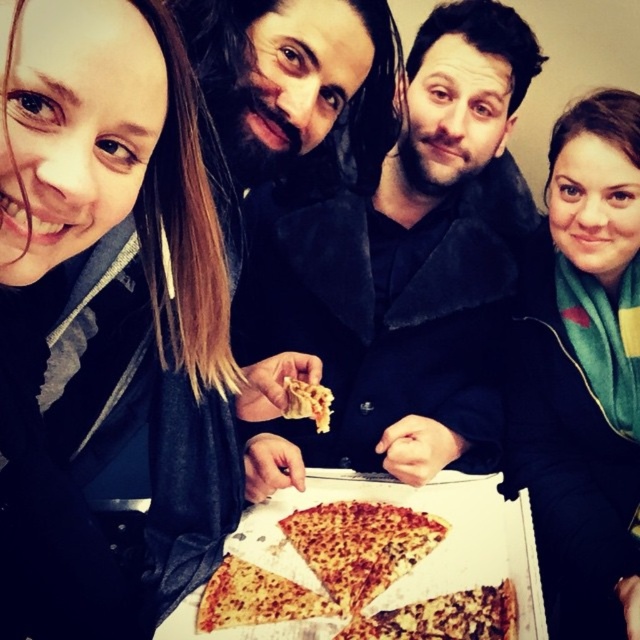
Question: Which object appears farthest from the camera in this image?

Choices:
 (A) cheesy crusty pizza at center
 (B) matte black scarf at upper left
 (C) green scarf at upper right
 (D) white cardboard box at center

Answer: (A)

Question: In this image, where is matte black scarf at upper left located relative to white cardboard box at center?

Choices:
 (A) above
 (B) below

Answer: (A)

Question: Among these objects, which one is farthest from the camera?

Choices:
 (A) green scarf at upper right
 (B) cheesy pizza at center
 (C) matte black scarf at upper left
 (D) dark blue coat at center

Answer: (D)

Question: Is matte black scarf at upper left positioned at the back of cheesy pizza at center?

Choices:
 (A) yes
 (B) no

Answer: (B)

Question: Which of the following is the farthest from the observer?

Choices:
 (A) (305, 417)
 (B) (326, 205)
 (C) (321, 557)
 (D) (260, 595)

Answer: (A)

Question: Is white cardboard box at center to the left of cheesy crusty pizza at center from the viewer's perspective?

Choices:
 (A) yes
 (B) no

Answer: (B)